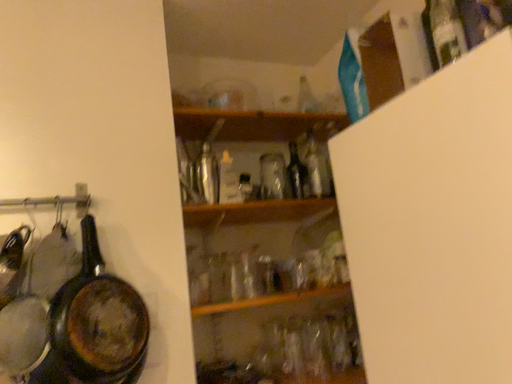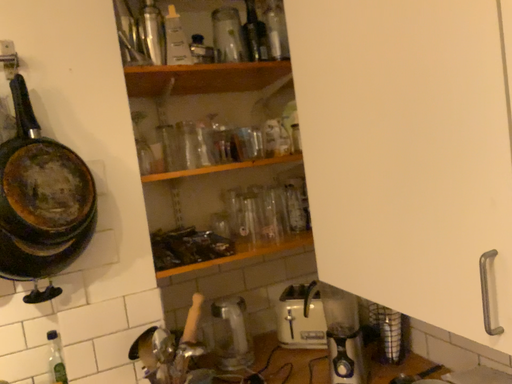
Question: How did the camera likely rotate when shooting the video?

Choices:
 (A) rotated downward
 (B) rotated upward

Answer: (A)